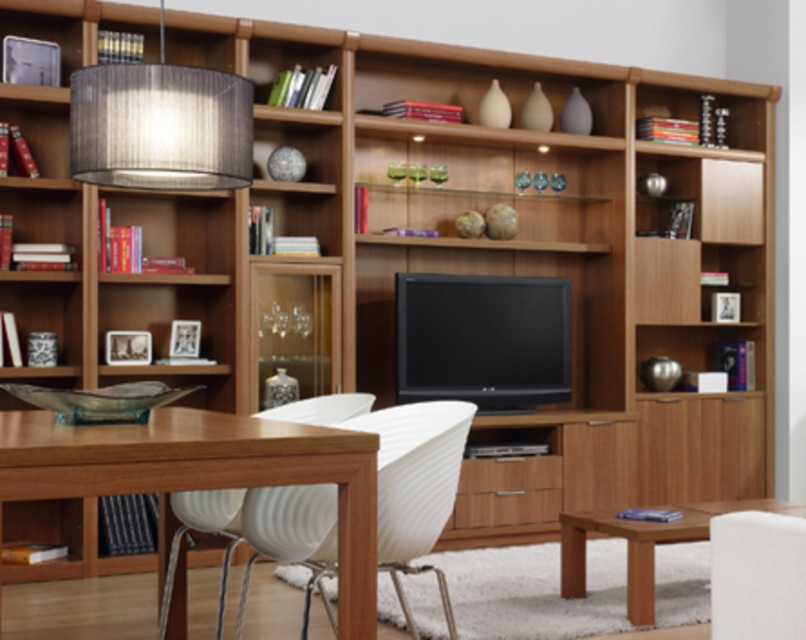
You are standing at the center of the room and want to walk to the wooden table at lower left. Which direction should you move in to reach it?

Since the wooden table at lower left is located at coordinates 0.742 on the x axis and 0.253 on the y axis, you should move towards the lower left direction to reach it.

You are standing in the living room and want to place a small plant pot exactly at the point marked as point (414,474). Which object from the scene is located at that exact coordinate?

The white ribbed plastic chair at center is located at point (414,474).